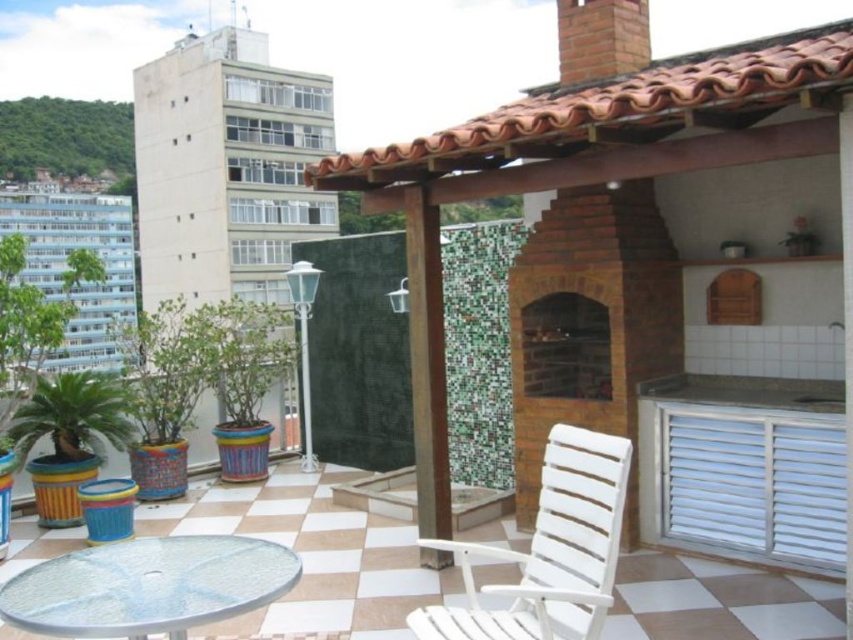
Which of these two, brick fireplace at center or brown wood pillar at center, stands shorter?

Standing shorter between the two is brown wood pillar at center.

Is brick fireplace at center further to camera compared to brown wood pillar at center?

Yes, it is behind brown wood pillar at center.

The image size is (853, 640). Describe the element at coordinates (590, 324) in the screenshot. I see `brick fireplace at center` at that location.

Identify the location of brick fireplace at center. (590, 324).

Looking at this image, is transparent glass table at lower left below green matte potted plant at lower left?

Indeed, transparent glass table at lower left is positioned under green matte potted plant at lower left.

Is point (132, 602) more distant than point (109, 388)?

No, it is not.

Is point (55, 614) more distant than point (67, 451)?

No, it is in front of (67, 451).

Identify the location of transparent glass table at lower left. This screenshot has width=853, height=640. (148, 586).

Who is positioned more to the right, white plastic chair at center or green matte potted plant at lower left?

white plastic chair at center is more to the right.

Is white plastic chair at center further to camera compared to green matte potted plant at lower left?

No.

Is point (462, 612) less distant than point (86, 385)?

Yes.

You are a GUI agent. You are given a task and a screenshot of the screen. Output one action in this format:
    pyautogui.click(x=<x>, y=<y>)
    Task: Click on the white plastic chair at center
    
    Given the screenshot: What is the action you would take?
    pyautogui.click(x=548, y=550)